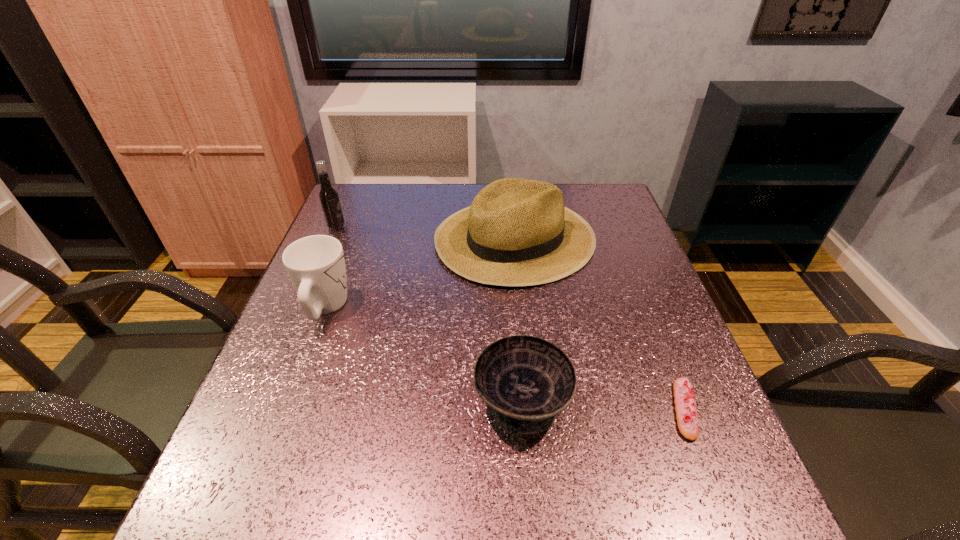
You are a GUI agent. You are given a task and a screenshot of the screen. Output one action in this format:
    pyautogui.click(x=<x>, y=<y>)
    Task: Click on the vacant space that satisfies the following two spatial constraints: 1. on the front side of the eclair; 2. on the right side of the sunhat
    The image size is (960, 540).
    Given the screenshot: What is the action you would take?
    pyautogui.click(x=533, y=409)

Identify the location of free space that satisfies the following two spatial constraints: 1. on the label of the root beer; 2. on the right side of the shortest object. (258, 409).

The height and width of the screenshot is (540, 960). Identify the location of vacant space that satisfies the following two spatial constraints: 1. on the side of the sunhat with the handle; 2. on the right side of the mug. (351, 238).

The width and height of the screenshot is (960, 540). I want to click on free space that satisfies the following two spatial constraints: 1. on the front side of the eclair; 2. on the right side of the fourth tallest object, so click(x=523, y=409).